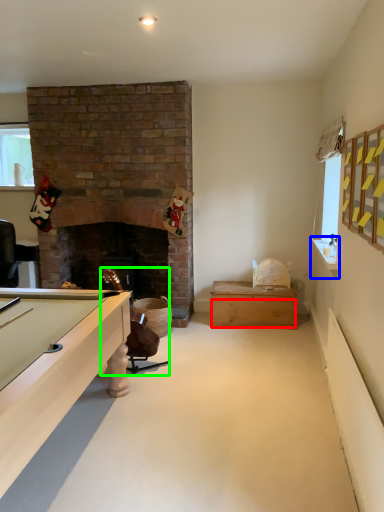
Question: Which is nearer to the drawer (highlighted by a red box)? counter top (highlighted by a blue box) or chair (highlighted by a green box).

Choices:
 (A) counter top
 (B) chair

Answer: (B)